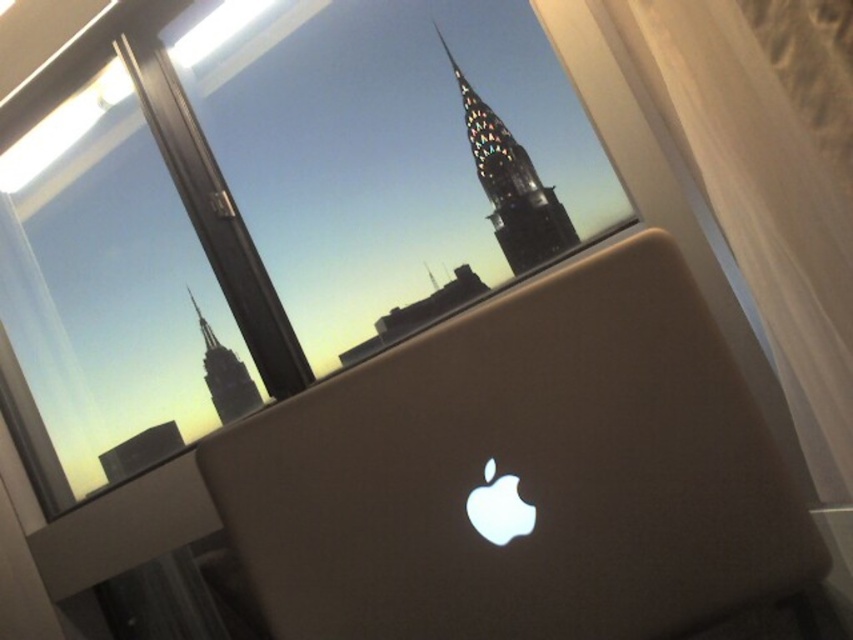
You are a photographer trying to capture both the satin gold laptop at center and the dark gray glass skyscraper at center in a single shot. Based on their positions, which object will appear larger in the photo?

The satin gold laptop at center will appear larger in the photo because it is closer to the viewer than the dark gray glass skyscraper at center.